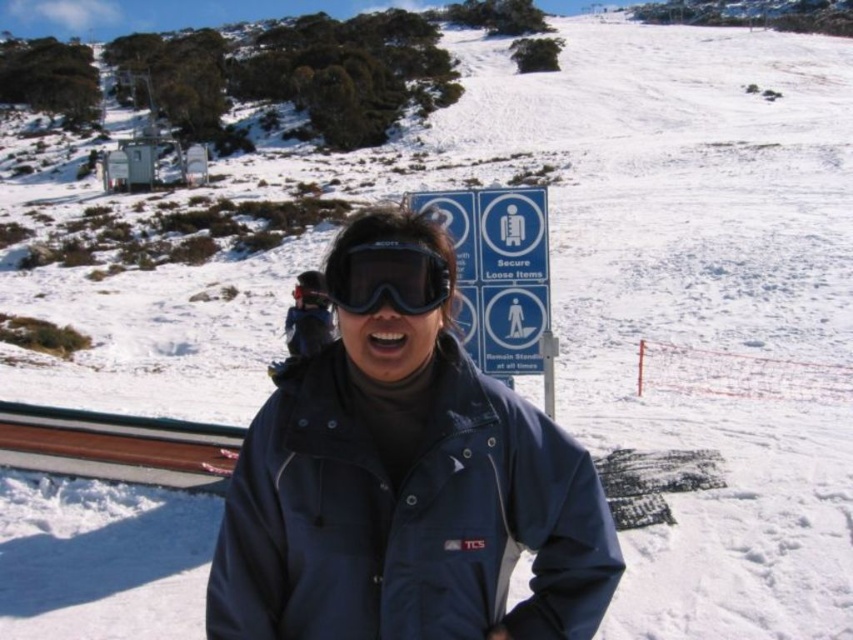
You are a photographer trying to capture both the navy blue jacket at center and the blue plastic sign at center in a single shot. Based on their sizes, will you need to zoom in or zoom out to ensure both fit in the frame?

The navy blue jacket at center might be wider than blue plastic sign at center, so you should zoom out to ensure both fit in the frame.

You are a skier standing at the bottom of the slope and see the blue plastic sign at center. If you want to reach the sign as quickly as possible, which direction should you head towards?

The blue plastic sign at center is located at point coordinates (497,272), so you should head towards the center right direction to reach it quickly.

You are standing at the point marked by the coordinates point (527, 284) in the snowy mountain landscape. You want to walk back to where the viewer is positioned. How far will you have to walk?

You will have to walk 31.16 feet to reach the viewer from point (527, 284).